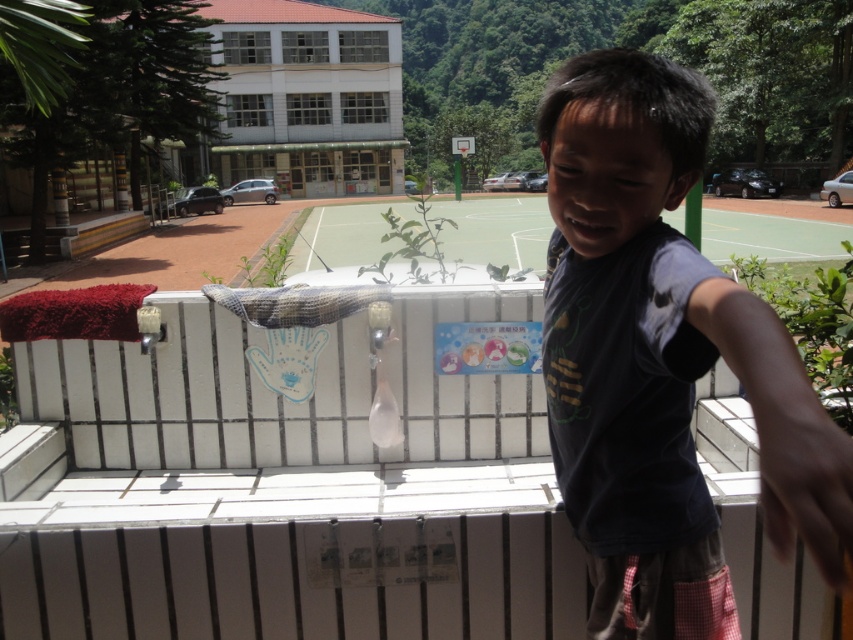
In the scene shown: You are a drone operator trying to capture a photo of the white tile balcony at center. The drone is currently at point [281,486]. Is the drone positioned correctly to take a clear photo of the white tile balcony at center?

Yes, the drone is positioned correctly because the white tile balcony at center is located exactly at point [281,486] where the drone is currently situated.